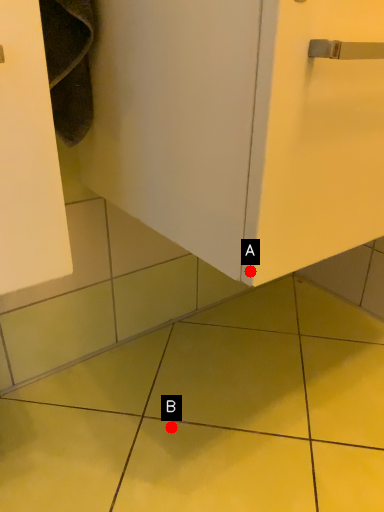
Question: Two points are circled on the image, labeled by A and B beside each circle. Which of the following is the closest to the observer?

Choices:
 (A) A is closer
 (B) B is closer

Answer: (A)